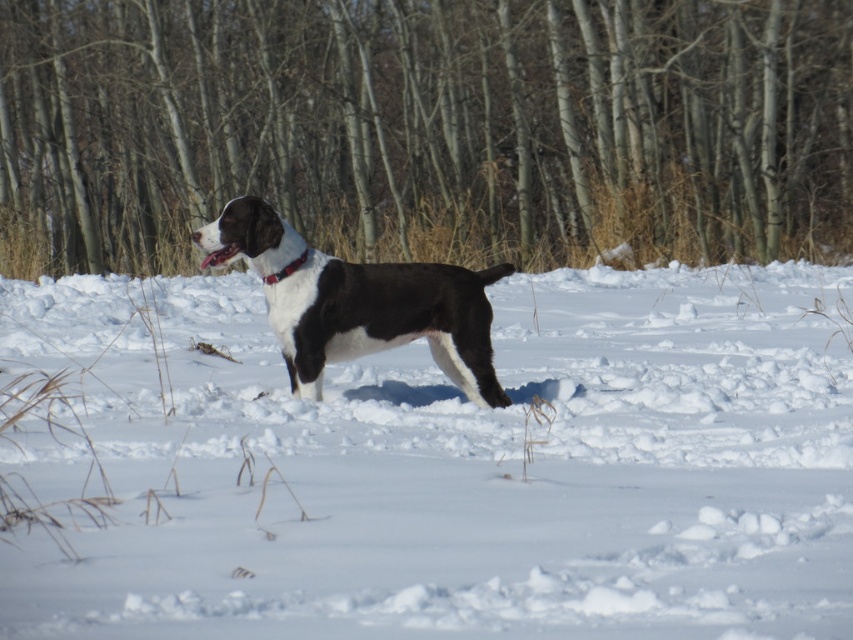
You are a photographer trying to capture a photo of the black matte dog at center and the brown bark tree at center. Which object should you focus on first if you want to ensure both are in sharp focus, considering their sizes?

The brown bark tree at center is larger in size than the black matte dog at center, so you should focus on the brown bark tree at center first to ensure both are in sharp focus.

You are standing in the snowy scene and notice the black matte dog at center and the red leather collar at center. Which object is positioned to the left?

The red leather collar at center is positioned to the left of the black matte dog at center.

You are standing at the origin point of the coordinate system. You see the white fluffy snow at center. In which direction should you move to reach it?

The white fluffy snow at center is located at coordinate point (457, 467). Since the origin is at (0, 0), you should move towards the positive x and positive y directions to reach it.